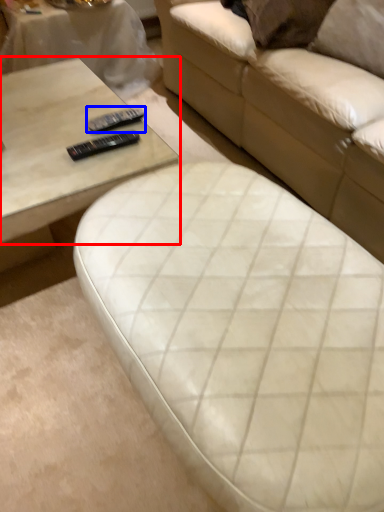
Question: Which object appears closest to the camera in this image, coffee table (highlighted by a red box) or remote (highlighted by a blue box)?

Choices:
 (A) coffee table
 (B) remote

Answer: (A)